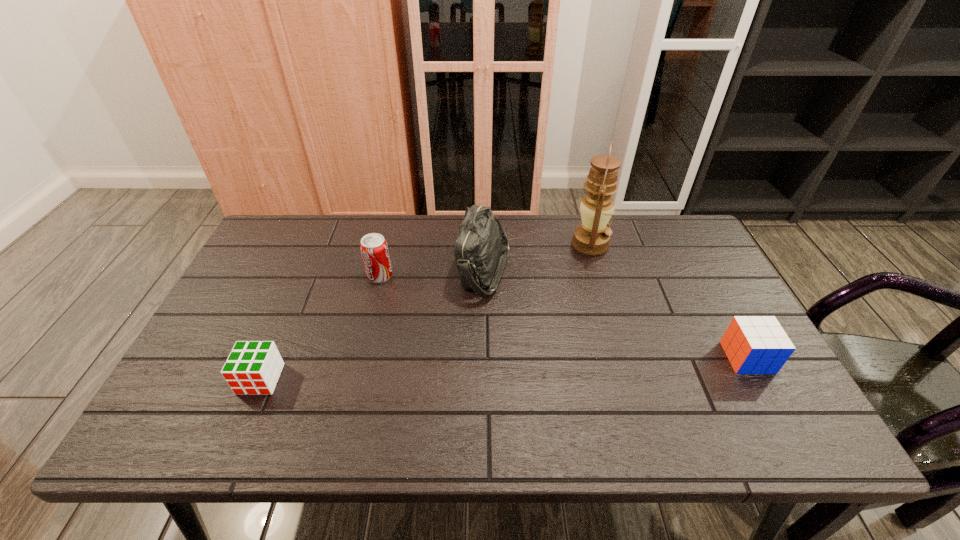
You are a GUI agent. You are given a task and a screenshot of the screen. Output one action in this format:
    pyautogui.click(x=<x>, y=<y>)
    Task: Click on the vacant space located at the front padded panel of the shoulder bag
    The width and height of the screenshot is (960, 540).
    Given the screenshot: What is the action you would take?
    pyautogui.click(x=396, y=270)

Where is `vacant space located 0.060m at the front padded panel of the shoulder bag`? Image resolution: width=960 pixels, height=540 pixels. vacant space located 0.060m at the front padded panel of the shoulder bag is located at coordinates (437, 270).

Find the location of a particular element. This screenshot has height=540, width=960. free space located on the left of the third shortest object is located at coordinates (333, 275).

The height and width of the screenshot is (540, 960). In order to click on free point located on the front of the right cube in this screenshot , I will do `click(789, 434)`.

Identify the location of free spot located on the red face of the leftmost object. (236, 437).

This screenshot has width=960, height=540. I want to click on oil lamp located in the far edge section of the desktop, so click(x=592, y=237).

You are a GUI agent. You are given a task and a screenshot of the screen. Output one action in this format:
    pyautogui.click(x=<x>, y=<y>)
    Task: Click on the shoulder bag positioned at the far edge
    
    Given the screenshot: What is the action you would take?
    tap(481, 250)

Identify the location of object that is at the left edge. (253, 368).

Locate an element on the screen. Image resolution: width=960 pixels, height=540 pixels. object that is at the right edge is located at coordinates (753, 344).

What are the coordinates of `vacant area at the far edge of the desktop` in the screenshot? It's located at (527, 245).